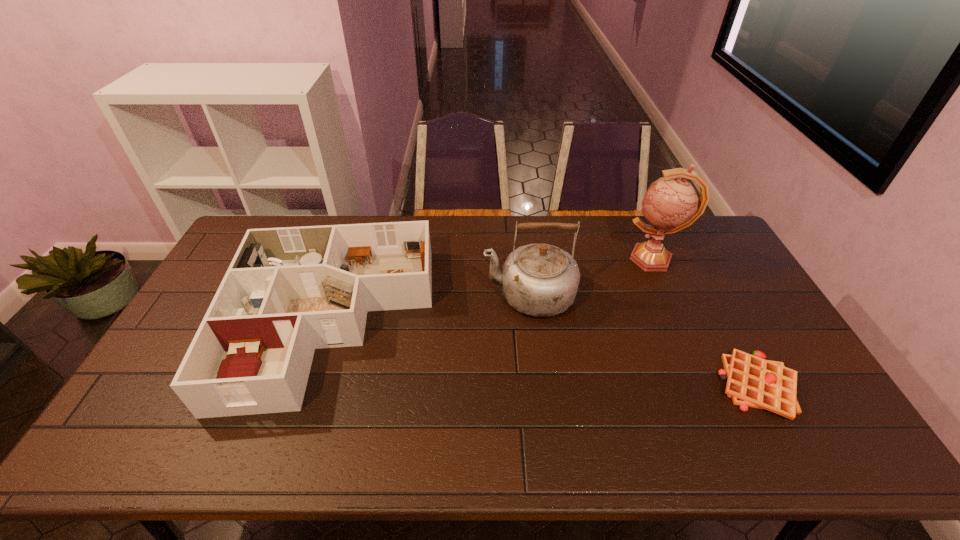
Identify the location of free location located 0.150m at the spout of the kettle. The height and width of the screenshot is (540, 960). point(436,295).

In order to click on vacant space situated at the spout of the kettle in this screenshot , I will do `click(376, 295)`.

What are the coordinates of `vacant space located on the right of the leftmost object` in the screenshot? It's located at (507, 321).

This screenshot has height=540, width=960. I want to click on vacant point located 0.290m on the back of the waffle, so click(x=703, y=282).

At what (x,y) coordinates should I click in order to perform the action: click on globe at the far edge. Please return your answer as a coordinate pair (x, y). Image resolution: width=960 pixels, height=540 pixels. Looking at the image, I should click on (670, 204).

Where is `dollhouse that is at the far edge`? dollhouse that is at the far edge is located at coordinates (288, 291).

Find the location of `object present at the left edge`. object present at the left edge is located at coordinates tap(288, 291).

Identify the location of object situated at the right edge. (752, 381).

This screenshot has height=540, width=960. I want to click on object that is at the far left corner, so click(x=288, y=291).

The height and width of the screenshot is (540, 960). In order to click on free space at the far edge of the desktop in this screenshot , I will do `click(468, 254)`.